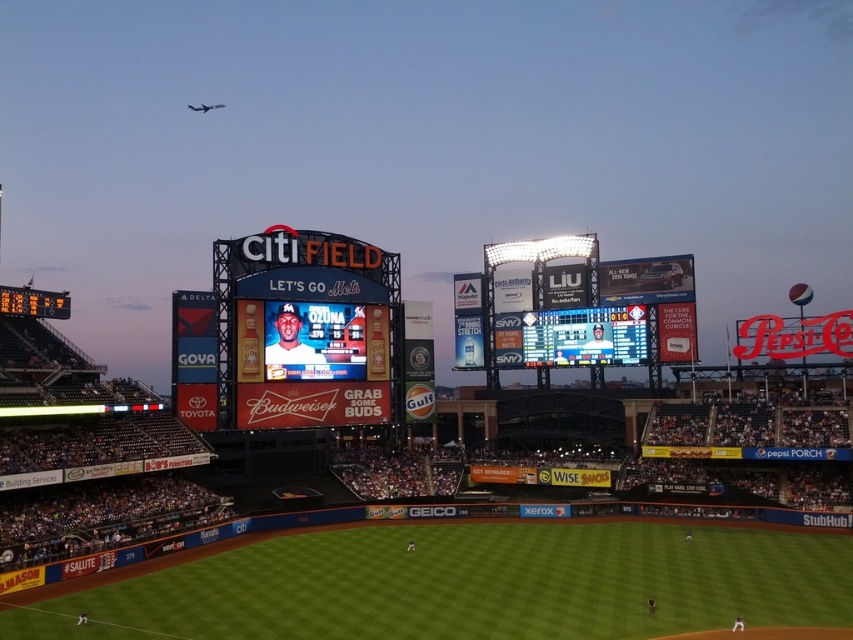
Which is above, matte digital display at center or matte digital scoreboard at center?

matte digital display at center is higher up.

Who is shorter, matte digital display at center or matte digital scoreboard at center?

matte digital scoreboard at center

Is point (321, 337) behind point (612, 353)?

That is False.

The height and width of the screenshot is (640, 853). In order to click on matte digital display at center in this screenshot , I will do `click(306, 330)`.

Between point (393, 362) and point (45, 310), which one is positioned in front?

Positioned in front is point (45, 310).

Who is more forward, (x=264, y=324) or (x=24, y=292)?

Point (x=24, y=292)

Locate an element on the screen. matte digital display at center is located at coordinates (306, 330).

Does matte digital scoreboard at center have a lesser width compared to orange digital scoreboard at left?

No.

Does matte digital scoreboard at center appear under orange digital scoreboard at left?

Indeed, matte digital scoreboard at center is positioned under orange digital scoreboard at left.

The width and height of the screenshot is (853, 640). I want to click on matte digital scoreboard at center, so click(584, 337).